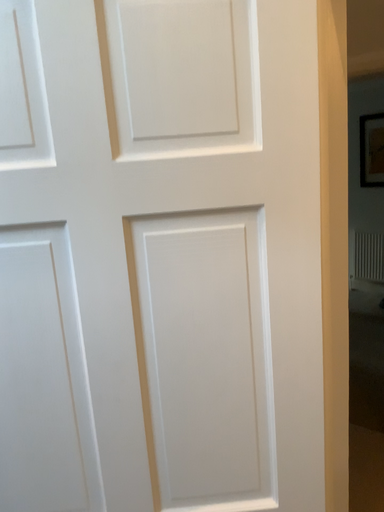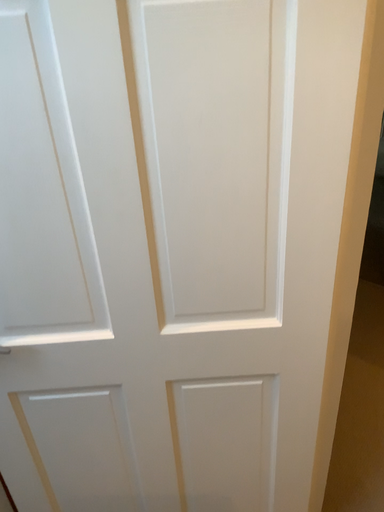
Question: How did the camera likely rotate when shooting the video?

Choices:
 (A) rotated upward
 (B) rotated downward

Answer: (B)